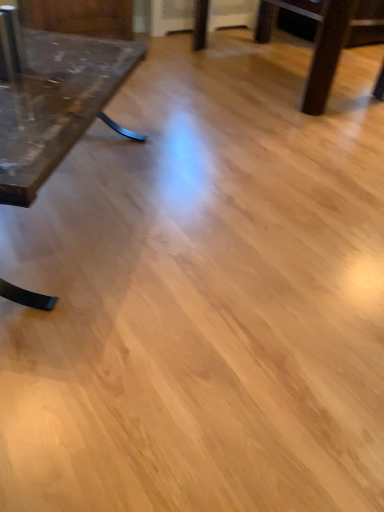
Where is `vacant space to the right of matte glass table at left`? The image size is (384, 512). vacant space to the right of matte glass table at left is located at coordinates (224, 226).